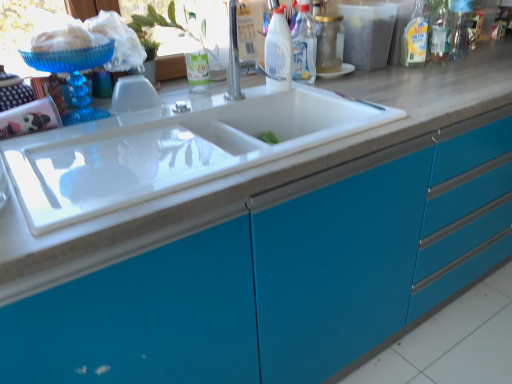
This screenshot has width=512, height=384. I want to click on vacant area to the right of clear plastic bottle at upper right, so click(x=459, y=67).